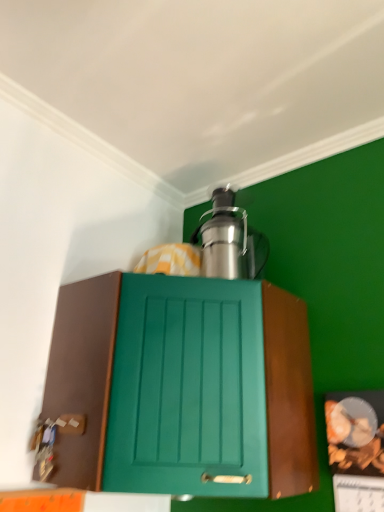
Question: Is teal matte cabinet at center bigger or smaller than satin silver coffee maker at upper center?

Choices:
 (A) big
 (B) small

Answer: (A)

Question: Is teal matte cabinet at center inside or outside of satin silver coffee maker at upper center?

Choices:
 (A) outside
 (B) inside

Answer: (A)

Question: Considering the positions of teal matte cabinet at center and satin silver coffee maker at upper center in the image, is teal matte cabinet at center wider or thinner than satin silver coffee maker at upper center?

Choices:
 (A) thin
 (B) wide

Answer: (B)

Question: Is satin silver coffee maker at upper center spatially inside teal matte cabinet at center, or outside of it?

Choices:
 (A) outside
 (B) inside

Answer: (A)

Question: Looking at their shapes, would you say satin silver coffee maker at upper center is wider or thinner than teal matte cabinet at center?

Choices:
 (A) wide
 (B) thin

Answer: (B)

Question: From a real-world perspective, relative to teal matte cabinet at center, is satin silver coffee maker at upper center vertically above or below?

Choices:
 (A) above
 (B) below

Answer: (A)

Question: Is point (244, 219) positioned closer to the camera than point (279, 345)?

Choices:
 (A) closer
 (B) farther

Answer: (B)